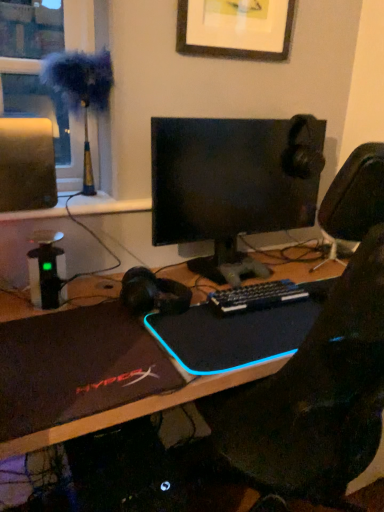
Question: Which is correct: black matte laptop at center, arranged as the first laptop when viewed from the right, is inside wooden picture frame at upper center, or outside of it?

Choices:
 (A) outside
 (B) inside

Answer: (A)

Question: In the image, is black matte laptop at center, placed as the second laptop when sorted from left to right, on the left side or the right side of wooden picture frame at upper center?

Choices:
 (A) right
 (B) left

Answer: (A)

Question: Which object is positioned closest to the matte black laptop at lower left, which appears as the first laptop when viewed from the left?

Choices:
 (A) black matte laptop at center, placed as the second laptop when sorted from left to right
 (B) black matte desk at center
 (C) black glossy monitor at center
 (D) black plastic keyboard at center
 (E) wooden picture frame at upper center

Answer: (A)

Question: Which object is positioned farthest from the black glossy monitor at center?

Choices:
 (A) matte black laptop at lower left, which appears as the first laptop when viewed from the left
 (B) black plastic keyboard at center
 (C) wooden picture frame at upper center
 (D) fuzzy fabric at left
 (E) black matte laptop at center, arranged as the first laptop when viewed from the right

Answer: (D)